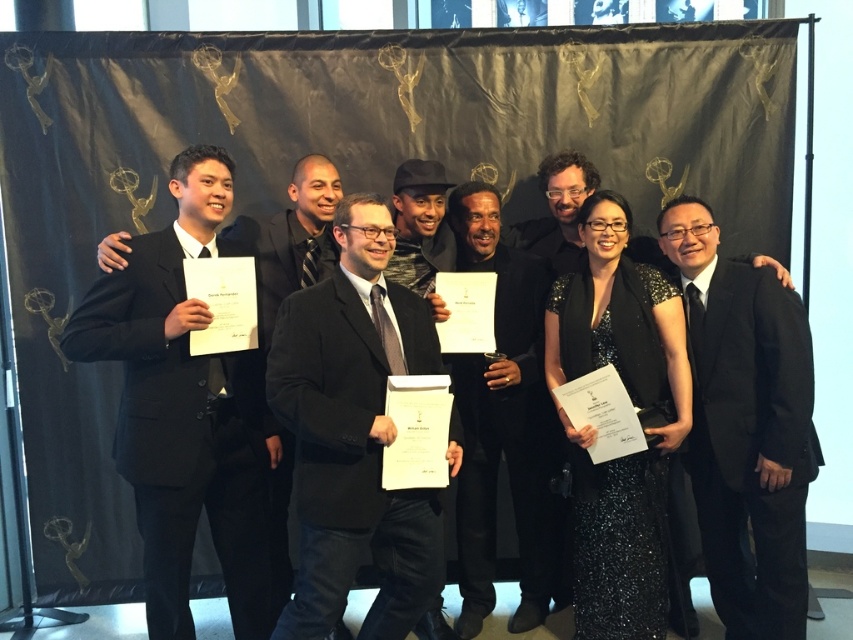
Does black matte suit at left have a lesser height compared to black suit at right?

No.

Is point (160, 234) positioned behind point (708, 282)?

That is False.

Which is in front, point (164, 387) or point (757, 480)?

Positioned in front is point (164, 387).

This screenshot has height=640, width=853. What are the coordinates of `black matte suit at left` in the screenshot? It's located at (186, 412).

Can you confirm if black velvet suit at center is positioned below black textured hat at center?

Correct, black velvet suit at center is located below black textured hat at center.

Does black velvet suit at center have a greater height compared to black textured hat at center?

Yes, black velvet suit at center is taller than black textured hat at center.

Does point (492, 593) come closer to viewer compared to point (438, 198)?

No, (492, 593) is further to viewer.

At what (x,y) coordinates should I click in order to perform the action: click on black velvet suit at center. Please return your answer as a coordinate pair (x, y). Looking at the image, I should click on (503, 420).

Which is in front, point (186, 608) or point (442, 580)?

Positioned in front is point (442, 580).

Is point (80, 356) less distant than point (294, 307)?

That is False.

I want to click on black matte suit at left, so click(186, 412).